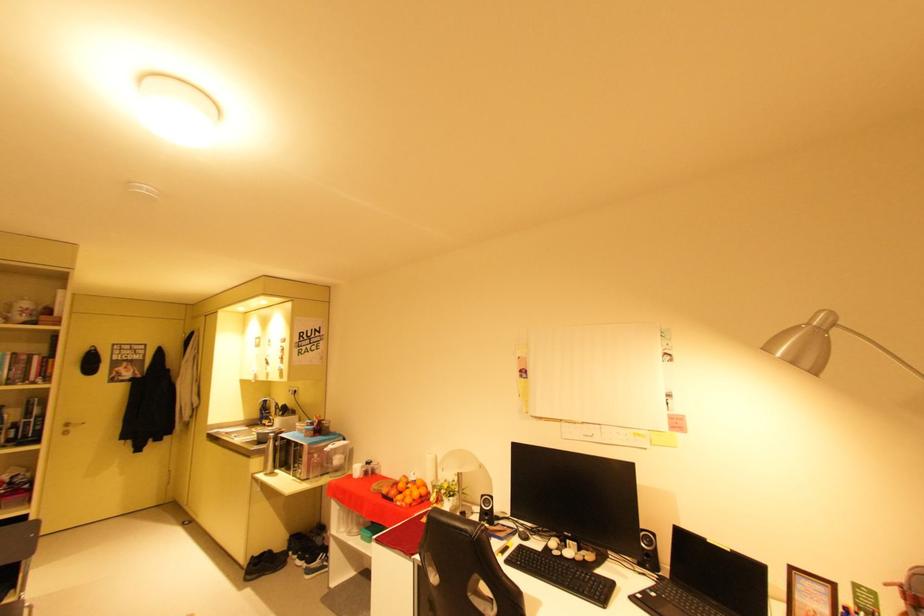
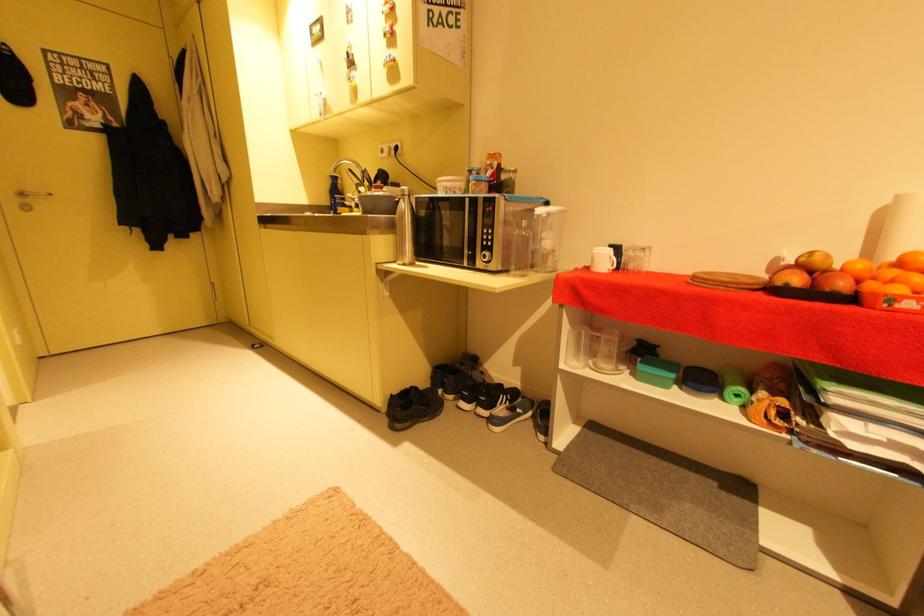
From the picture: In a continuous first-person perspective shot, in which direction is the camera moving?

The cameraman walked toward left, forward.